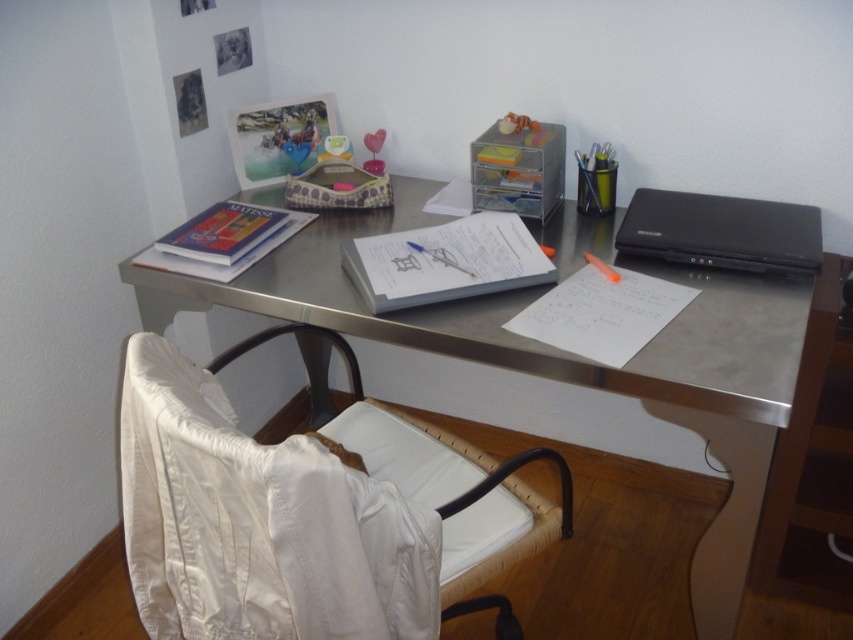
Question: Is white fabric swivel chair at lower left above black matte laptop at right?

Choices:
 (A) no
 (B) yes

Answer: (A)

Question: Estimate the real-world distances between objects in this image. Which object is farther from the white fabric swivel chair at lower left?

Choices:
 (A) hardcover book at upper left
 (B) metallic gray desk at center
 (C) white paper at center

Answer: (A)

Question: Can you confirm if white fabric swivel chair at lower left is thinner than metallic gray desk at center?

Choices:
 (A) no
 (B) yes

Answer: (B)

Question: Can you confirm if black matte laptop at right is positioned above hardcover book at upper left?

Choices:
 (A) yes
 (B) no

Answer: (A)

Question: Among these objects, which one is nearest to the camera?

Choices:
 (A) black matte laptop at right
 (B) hardcover book at upper left

Answer: (A)

Question: Which point is farther from the camera taking this photo?

Choices:
 (A) (805, 435)
 (B) (706, 232)

Answer: (A)